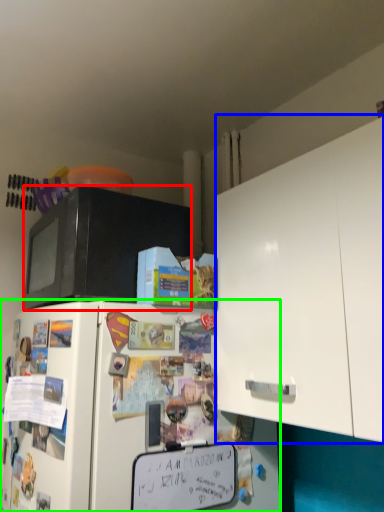
Question: Which object is positioned farthest from microwave oven (highlighted by a red box)? Select from cabinetry (highlighted by a blue box) and refrigerator (highlighted by a green box).

Choices:
 (A) cabinetry
 (B) refrigerator

Answer: (A)